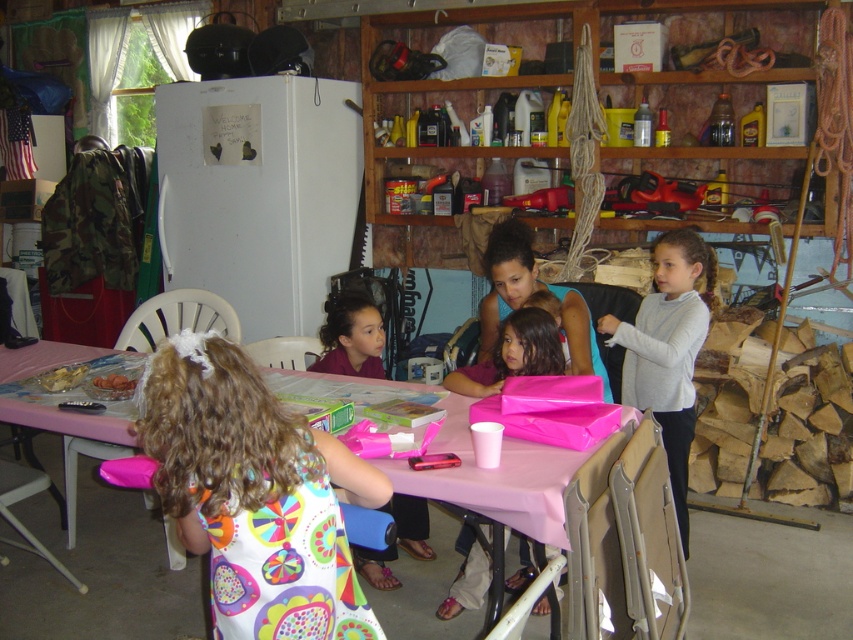
You are a guest at the birthday party and want to give a gift to the child sitting at the pink paper table at center. You are currently standing near the white sweater at upper right. Should you walk to your left or right to reach the table?

The pink paper table at center is to the left of white sweater at upper right, so you should walk to your left to reach the table.

You are planning to place a new gift bag on the table. Based on the image, can you determine if the pink matte gift bag at center will fit on the pink paper table at center?

The pink paper table at center might be wider than pink matte gift bag at center, so there is a possibility that the gift bag will fit, but it is uncertain without exact measurements.

You are at the birthday party in the garage and want to move from point A to point B. Point A is at coordinate point(225, 388) and point B is at coordinate point(430, 451). Which point is closer to you when you start at point A?

Point A is closer to the viewer than point B, so when you start at point A, point A is closer to you.